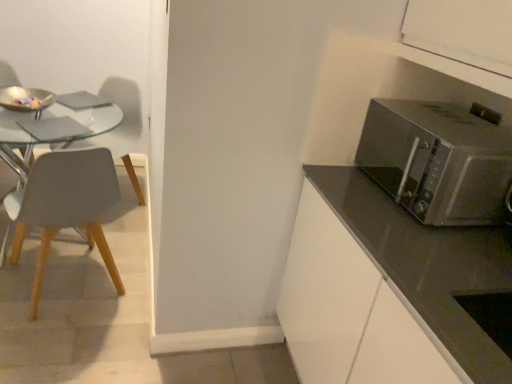
In order to click on vacant region under matte gray chair at left, the 2th chair viewed from the back (from a real-world perspective) in this screenshot , I will do `click(69, 294)`.